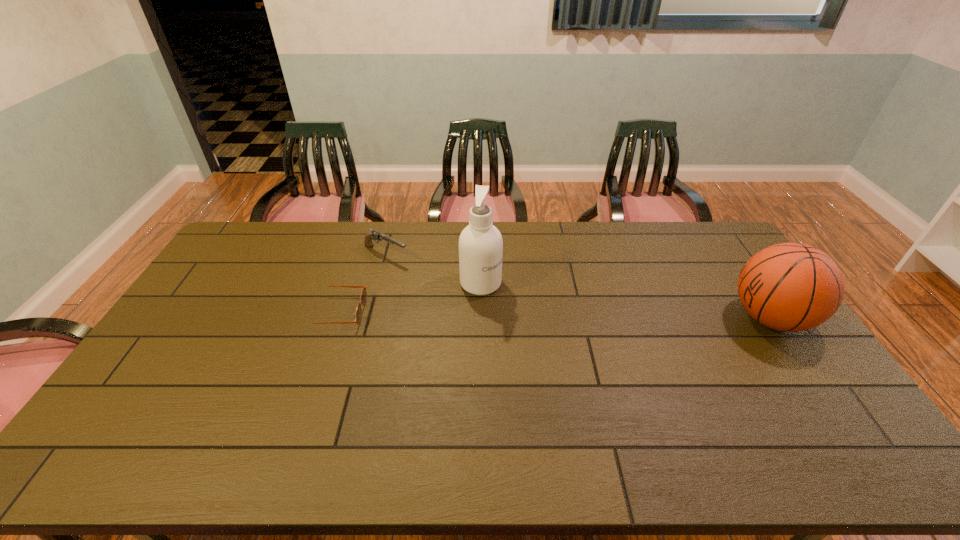
Locate an element on the screen. vacant space that's between the gun and the basketball is located at coordinates (578, 286).

Where is `vacant region between the gun and the shortest object`? vacant region between the gun and the shortest object is located at coordinates (x=362, y=283).

You are a GUI agent. You are given a task and a screenshot of the screen. Output one action in this format:
    pyautogui.click(x=<x>, y=<y>)
    Task: Click on the vacant space in between the sunglasses and the second shortest object
    Image resolution: width=960 pixels, height=540 pixels.
    Given the screenshot: What is the action you would take?
    pyautogui.click(x=362, y=283)

Locate an element on the screen. The height and width of the screenshot is (540, 960). free space between the farthest object and the second object from right to left is located at coordinates (433, 268).

The height and width of the screenshot is (540, 960). I want to click on object that stands as the closest to the sunglasses, so click(375, 235).

This screenshot has width=960, height=540. Find the location of `object identified as the closest to the farthest object`. object identified as the closest to the farthest object is located at coordinates (358, 313).

You are a GUI agent. You are given a task and a screenshot of the screen. Output one action in this format:
    pyautogui.click(x=<x>, y=<y>)
    Task: Click on the vacant area that satisfies the following two spatial constraints: 1. on the front side of the tallest object; 2. on the right side of the farthest object
    
    Given the screenshot: What is the action you would take?
    pyautogui.click(x=378, y=283)

The width and height of the screenshot is (960, 540). In order to click on free space that satisfies the following two spatial constraints: 1. on the front side of the basketball; 2. on the left side of the gun in this screenshot , I will do `click(369, 318)`.